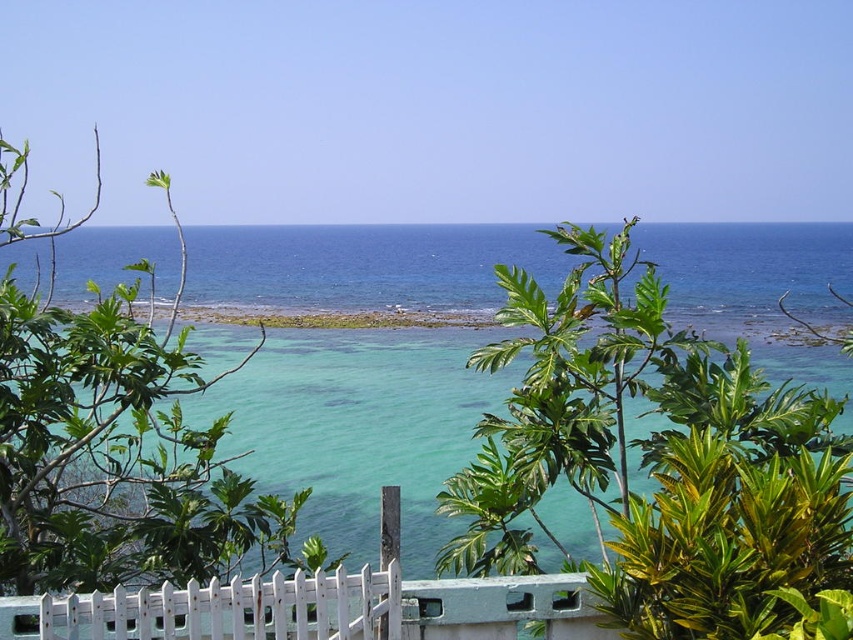
You are standing on the beach looking at the scene. Which object, the clear blue water at center or the white painted wood fence at center, is closer to you?

The clear blue water at center is closer to you because the white painted wood fence at center is behind it.

You are a photographer planning to capture the clear blue water at center and the white painted wood fence at center in a single shot. Given that the fence is closer to you, will the water appear larger in the photo?

The clear blue water at center has a larger size compared to the white painted wood fence at center, so yes, the water will appear larger in the photo even though the fence is closer to you.